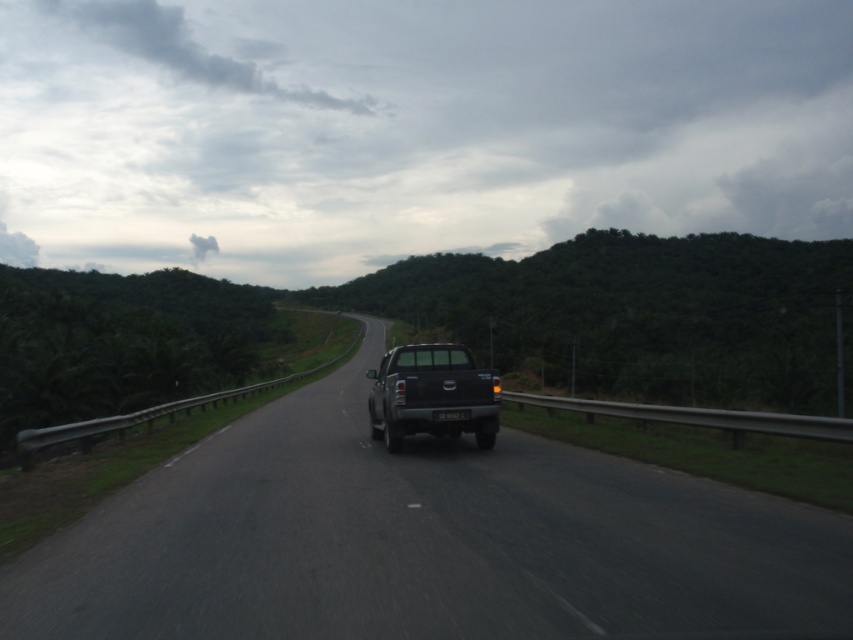
You are a driver approaching the road with two trucks ahead. The black matte truck at center and the matte black truck at center. Which truck is shorter in height?

The black matte truck at center is shorter than the matte black truck at center.

In the scene shown: You are standing at the point marked by point (424, 541), which is the location of the black matte truck at center. You want to walk to the nearest grassy verge. Which direction should you head towards?

The black matte truck at center is represented by point (424, 541). To reach the nearest grassy verge, you should head towards the left side of the road since the truck is positioned towards the right side of the road, and the grassy verge is on that side.

In the scene shown: You are a driver approaching the black matte truck at center and the matte black truck at center on the road. Which truck is closer to you?

The black matte truck at center is closer to you because it is positioned above the matte black truck at center in the image, which typically indicates it is nearer in a two dimensional perspective.